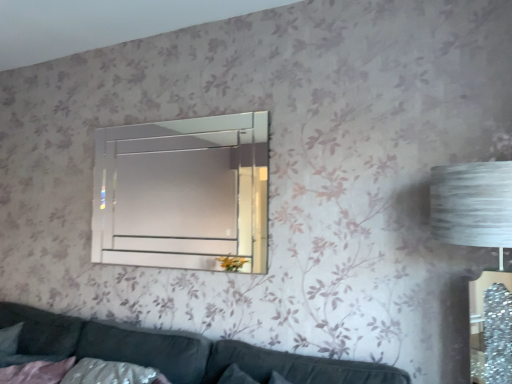
Question: Can you confirm if velvet dark grey couch at lower center is bigger than clear glass mirror at upper center?

Choices:
 (A) no
 (B) yes

Answer: (B)

Question: Is velvet dark grey couch at lower center not inside clear glass mirror at upper center?

Choices:
 (A) yes
 (B) no

Answer: (A)

Question: Is velvet dark grey couch at lower center looking in the opposite direction of clear glass mirror at upper center?

Choices:
 (A) yes
 (B) no

Answer: (B)

Question: Can you see velvet dark grey couch at lower center touching clear glass mirror at upper center?

Choices:
 (A) no
 (B) yes

Answer: (A)

Question: Considering the relative sizes of velvet dark grey couch at lower center and clear glass mirror at upper center in the image provided, is velvet dark grey couch at lower center wider than clear glass mirror at upper center?

Choices:
 (A) no
 (B) yes

Answer: (B)

Question: From a real-world perspective, is velvet dark grey couch at lower center positioned over clear glass mirror at upper center based on gravity?

Choices:
 (A) no
 (B) yes

Answer: (A)

Question: Can you confirm if clear glass mirror at upper center is taller than velvet dark grey couch at lower center?

Choices:
 (A) no
 (B) yes

Answer: (B)

Question: From the image's perspective, does clear glass mirror at upper center appear lower than velvet dark grey couch at lower center?

Choices:
 (A) no
 (B) yes

Answer: (A)

Question: Considering the relative sizes of clear glass mirror at upper center and velvet dark grey couch at lower center in the image provided, is clear glass mirror at upper center thinner than velvet dark grey couch at lower center?

Choices:
 (A) yes
 (B) no

Answer: (A)

Question: Is clear glass mirror at upper center at the left side of velvet dark grey couch at lower center?

Choices:
 (A) no
 (B) yes

Answer: (B)

Question: Can you confirm if clear glass mirror at upper center is shorter than velvet dark grey couch at lower center?

Choices:
 (A) yes
 (B) no

Answer: (B)

Question: Is clear glass mirror at upper center facing away from velvet dark grey couch at lower center?

Choices:
 (A) no
 (B) yes

Answer: (A)

Question: Is velvet dark grey couch at lower center taller or shorter than clear glass mirror at upper center?

Choices:
 (A) short
 (B) tall

Answer: (A)